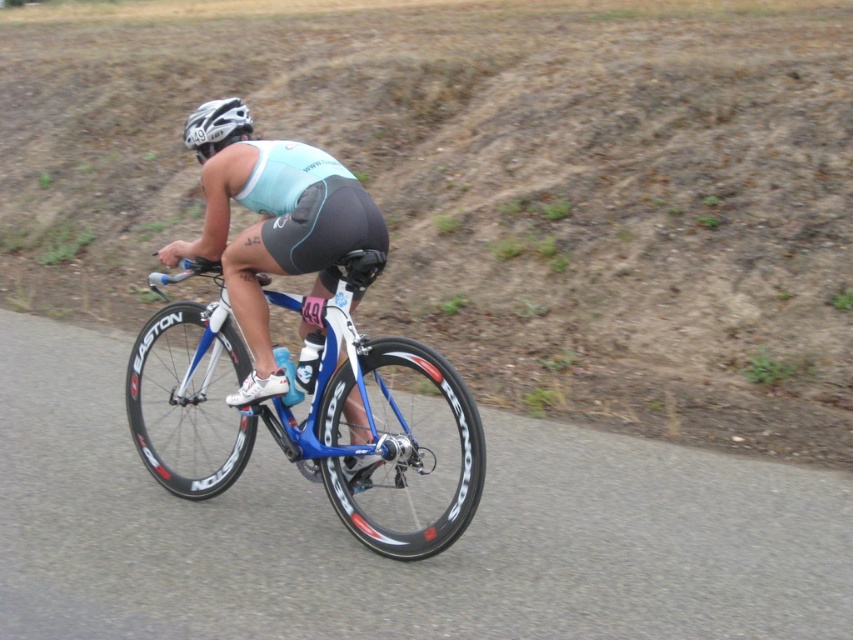
Is blue metallic bicycle at center smaller than white matte helmet at upper center?

No, blue metallic bicycle at center is not smaller than white matte helmet at upper center.

Which of these two, blue metallic bicycle at center or white matte helmet at upper center, stands taller?

With more height is blue metallic bicycle at center.

Is point (335, 317) in front of point (230, 124)?

Yes, point (335, 317) is in front of point (230, 124).

Where is `blue metallic bicycle at center`? Image resolution: width=853 pixels, height=640 pixels. blue metallic bicycle at center is located at coordinates (312, 413).